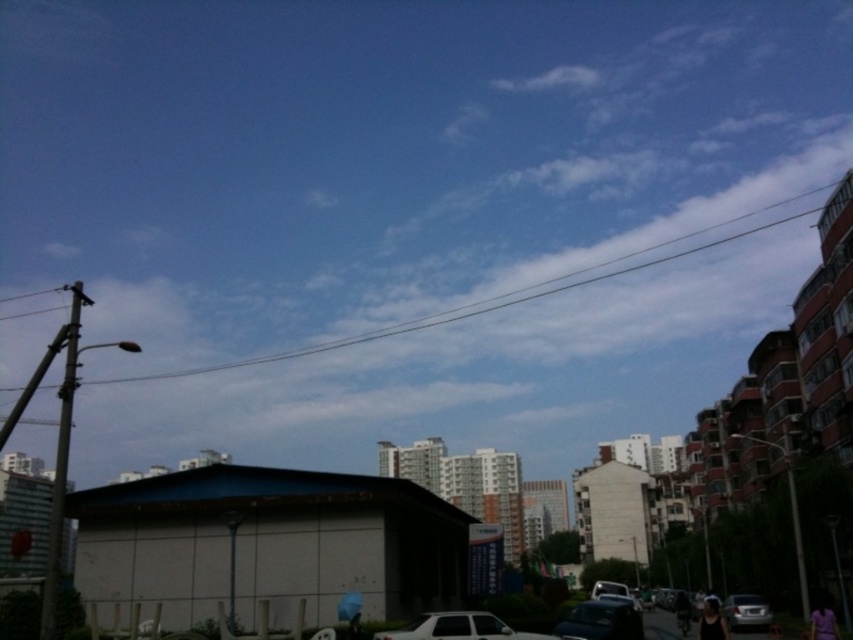
Question: Which point is farther to the camera?

Choices:
 (A) (x=421, y=632)
 (B) (x=605, y=620)
 (C) (x=746, y=595)

Answer: (C)

Question: Can you confirm if white matte car at lower center is bigger than shiny black car at center?

Choices:
 (A) no
 (B) yes

Answer: (A)

Question: Which of the following is the farthest from the observer?

Choices:
 (A) white matte car at lower center
 (B) satin silver sedan at lower right
 (C) shiny black car at center

Answer: (B)

Question: Is white matte car at lower center smaller than satin silver sedan at lower right?

Choices:
 (A) no
 (B) yes

Answer: (B)

Question: Which point is farther to the camera?

Choices:
 (A) shiny black car at center
 (B) satin silver sedan at lower right

Answer: (B)

Question: Can you confirm if white matte car at lower center is wider than satin silver sedan at lower right?

Choices:
 (A) yes
 (B) no

Answer: (B)